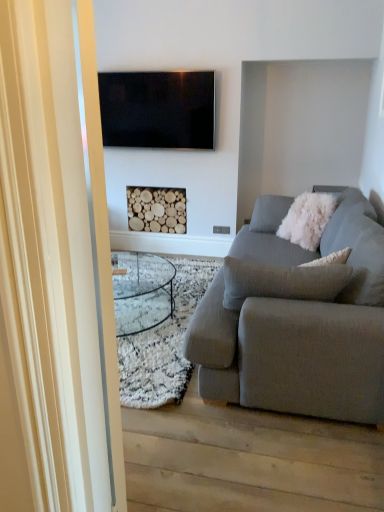
At what (x,y) coordinates should I click in order to perform the action: click on free spot to the right of transparent glass door at left. Please return your answer as a coordinate pair (x, y). Looking at the image, I should click on (203, 461).